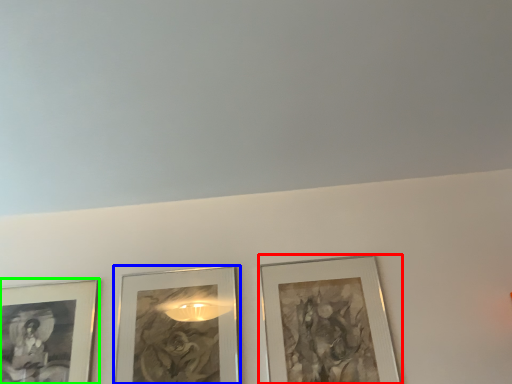
Question: Estimate the real-world distances between objects in this image. Which object is farther from picture frame (highlighted by a red box), picture frame (highlighted by a blue box) or picture frame (highlighted by a green box)?

Choices:
 (A) picture frame
 (B) picture frame

Answer: (B)